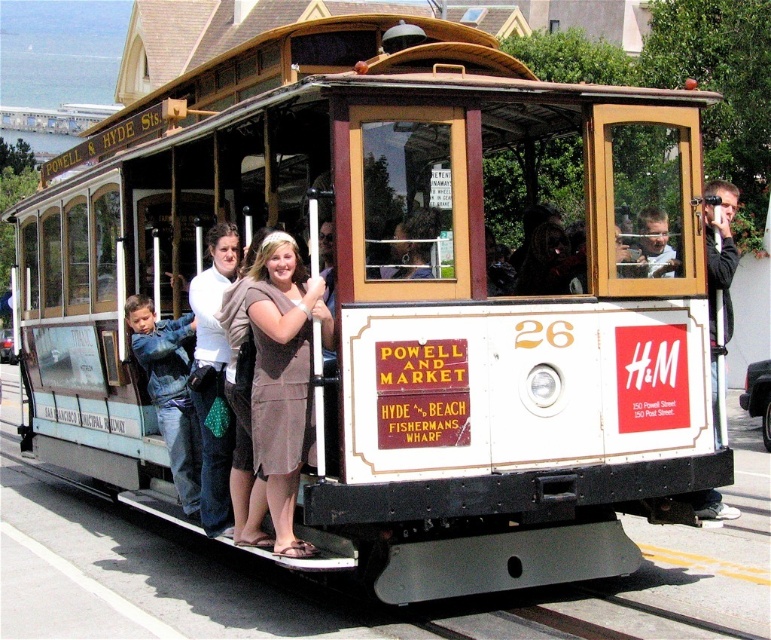
Question: Estimate the real-world distances between objects in this image. Which object is closer to the metallic silver camera at right?

Choices:
 (A) matte black camera at center
 (B) matte brown dress at center

Answer: (A)

Question: Is metallic silver camera at right wider than matte black camera at center?

Choices:
 (A) yes
 (B) no

Answer: (A)

Question: From the image, what is the correct spatial relationship of metallic silver camera at right in relation to matte black camera at center?

Choices:
 (A) right
 (B) left

Answer: (A)

Question: Among these objects, which one is farthest from the camera?

Choices:
 (A) matte black camera at center
 (B) metallic silver camera at right
 (C) matte brown dress at center

Answer: (A)

Question: Which object is positioned closest to the metallic silver camera at right?

Choices:
 (A) matte brown dress at center
 (B) matte black camera at center

Answer: (B)

Question: Is matte brown dress at center closer to camera compared to metallic silver camera at right?

Choices:
 (A) no
 (B) yes

Answer: (B)